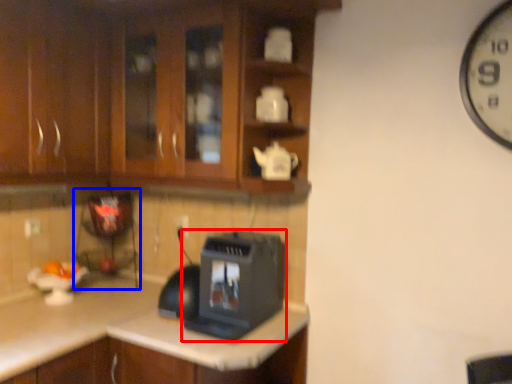
Question: Which of the following is the farthest to the observer, home appliance (highlighted by a red box) or appliance (highlighted by a blue box)?

Choices:
 (A) home appliance
 (B) appliance

Answer: (B)